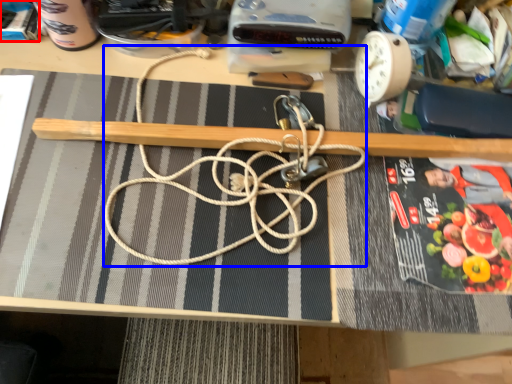
Question: Which object appears farthest to the camera in this image, paperback book (highlighted by a red box) or string (highlighted by a blue box)?

Choices:
 (A) paperback book
 (B) string

Answer: (A)